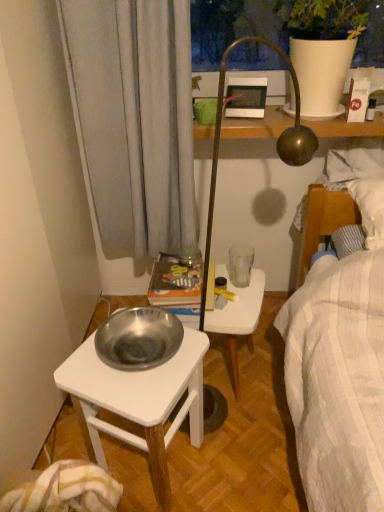
This screenshot has height=512, width=384. Find the location of `free point above silver metallic bowl at lower left (from a real-world perspective)`. free point above silver metallic bowl at lower left (from a real-world perspective) is located at coordinates (138, 360).